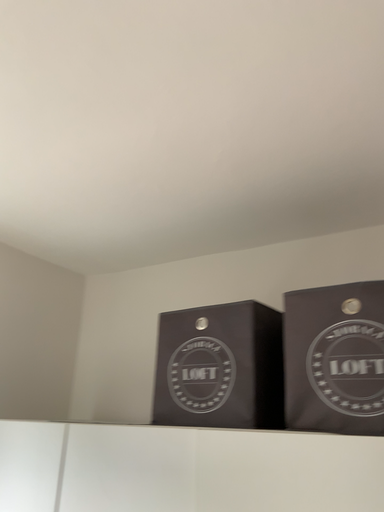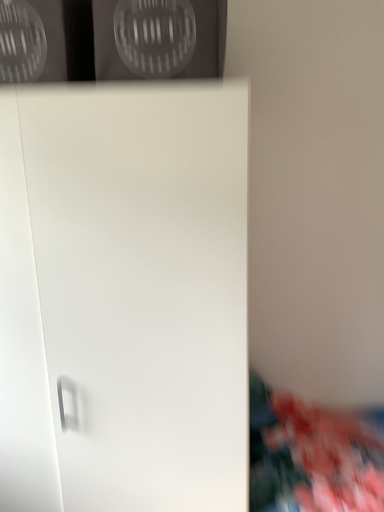
Question: Which way did the camera rotate in the video?

Choices:
 (A) rotated right
 (B) rotated left

Answer: (A)